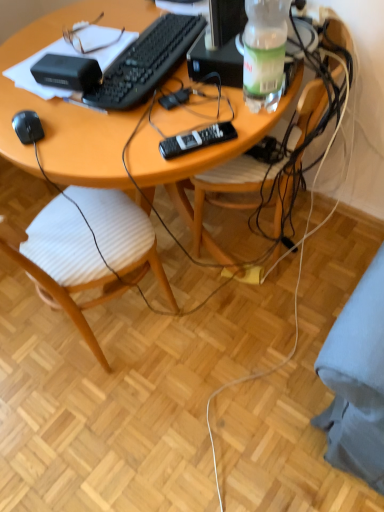
The width and height of the screenshot is (384, 512). What are the coordinates of `vacant space in between black matte keyboard at center and black plastic remote at center` in the screenshot? It's located at (181, 113).